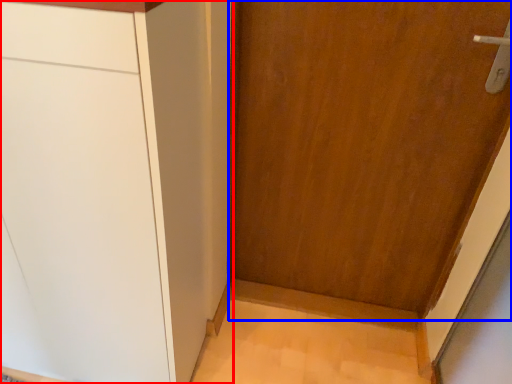
Question: Among these objects, which one is farthest to the camera, cabinetry (highlighted by a red box) or door (highlighted by a blue box)?

Choices:
 (A) cabinetry
 (B) door

Answer: (B)